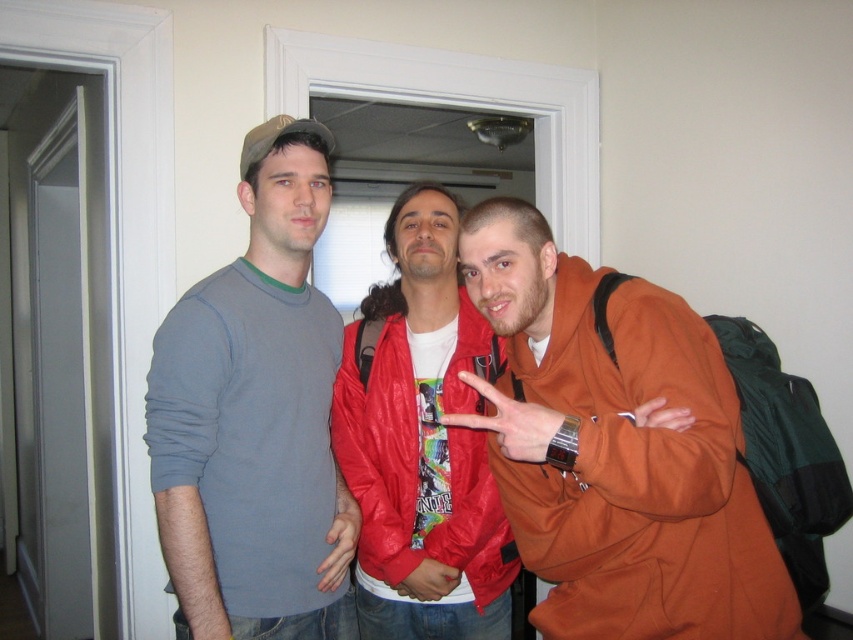
Question: Which point is closer to the camera taking this photo?

Choices:
 (A) (209, 317)
 (B) (537, 465)
 (C) (360, 426)

Answer: (A)

Question: Which object is farther from the camera taking this photo?

Choices:
 (A) shiny red jacket at center
 (B) orange fleece jacket at right

Answer: (A)

Question: Is matte gray t-shirt at center behind shiny red jacket at center?

Choices:
 (A) no
 (B) yes

Answer: (A)

Question: Is matte gray t-shirt at center smaller than shiny red jacket at center?

Choices:
 (A) no
 (B) yes

Answer: (A)

Question: Which point is closer to the camera taking this photo?

Choices:
 (A) (375, 404)
 (B) (177, 538)

Answer: (B)

Question: In this image, where is matte gray t-shirt at center located relative to orange fleece jacket at right?

Choices:
 (A) right
 (B) left

Answer: (B)